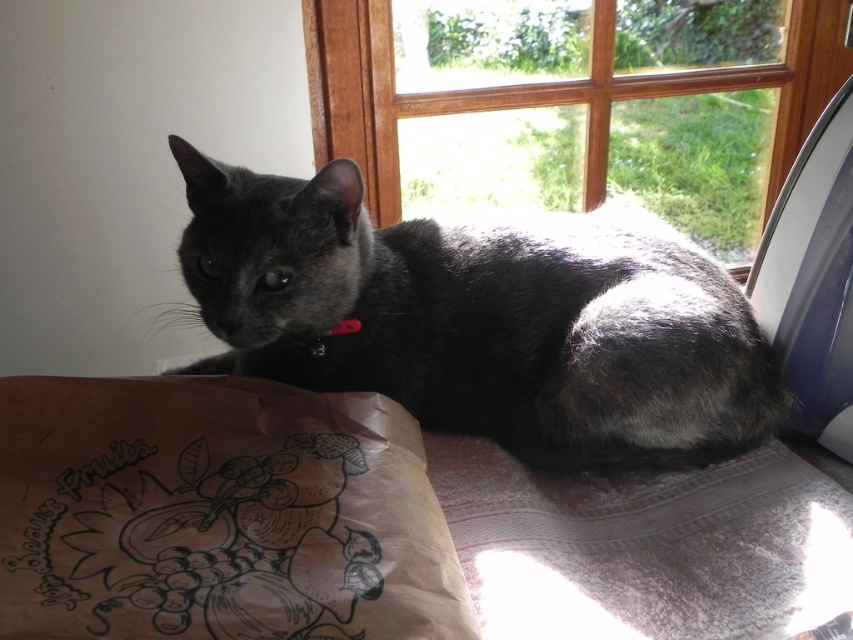
Which of these two, brown paper bag at lower left or black fabric neckband at center, stands shorter?

With less height is black fabric neckband at center.

Between point (424, 602) and point (346, 332), which one is positioned behind?

The point (346, 332) is behind.

Locate an element on the screen. brown paper bag at lower left is located at coordinates (218, 515).

Is brown paper bag at lower left positioned before wooden frame at upper center?

Yes, brown paper bag at lower left is in front of wooden frame at upper center.

Who is lower down, brown paper bag at lower left or wooden frame at upper center?

brown paper bag at lower left is below.

Is point (218, 561) positioned behind point (405, 74)?

No, (218, 561) is in front of (405, 74).

Identify the location of brown paper bag at lower left. (218, 515).

Is wooden frame at upper center above black fabric neckband at center?

Correct, wooden frame at upper center is located above black fabric neckband at center.

How much distance is there between wooden frame at upper center and black fabric neckband at center?

32.97 inches

The image size is (853, 640). What do you see at coordinates (576, 104) in the screenshot?
I see `wooden frame at upper center` at bounding box center [576, 104].

Locate an element on the screen. The image size is (853, 640). wooden frame at upper center is located at coordinates (576, 104).